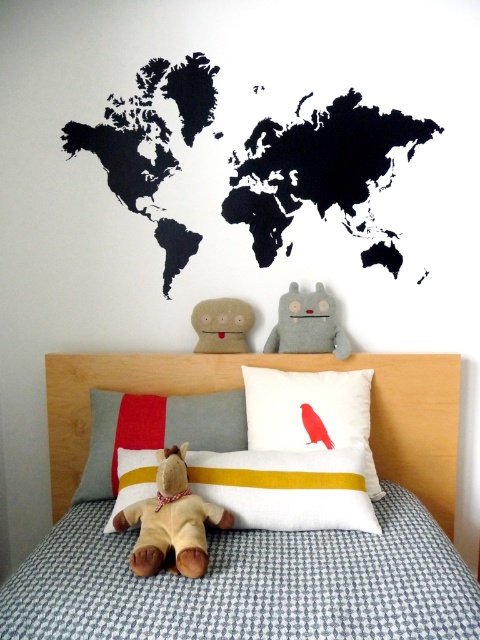
You are standing in the bedroom and want to determine which of the two points, point [273,220] or point [373,513], is closer to you. Based on the scene description, which point is nearer?

Point [273,220] is closer to you because it is further to the viewer than point [373,513].